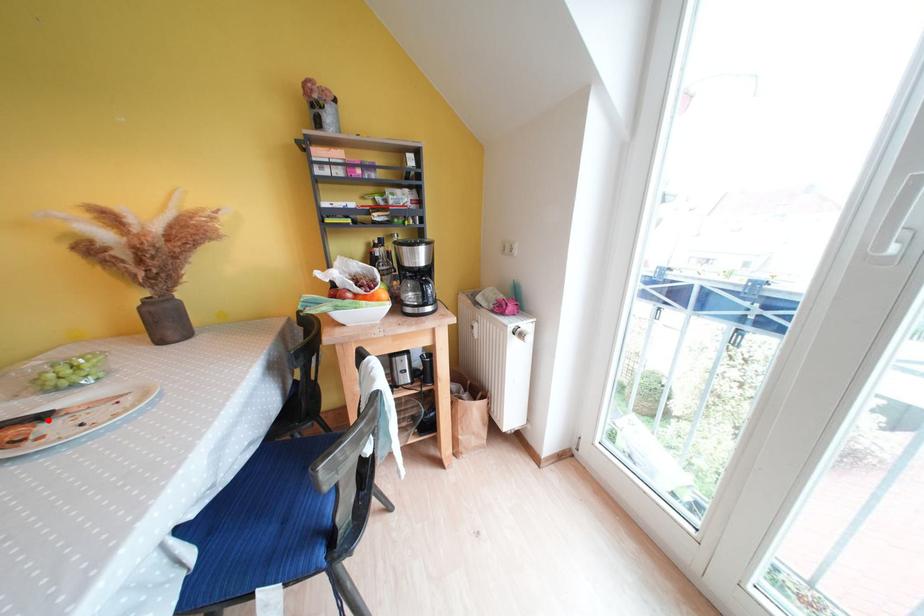
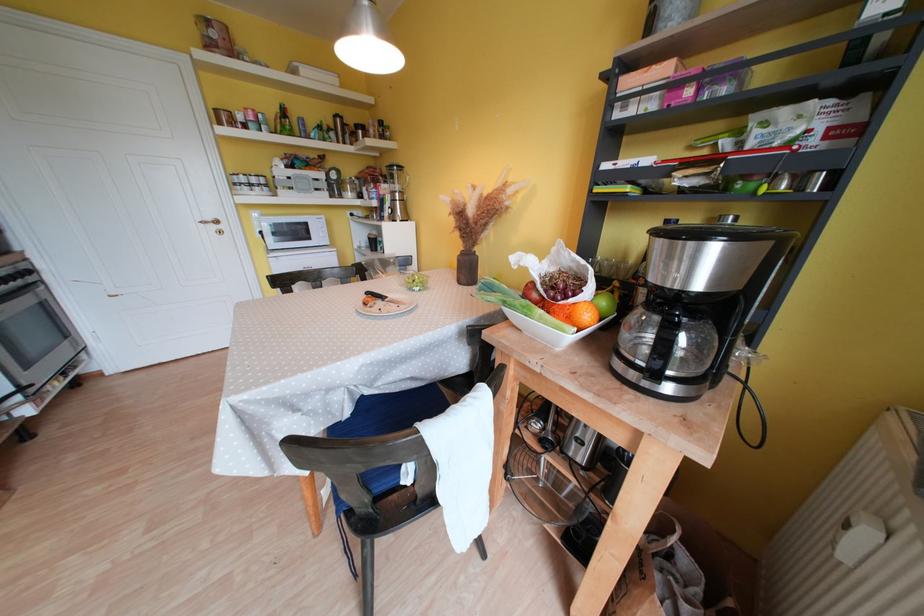
Where in the second image is the point corresponding to the highlighted location from the first image?

(390, 301)